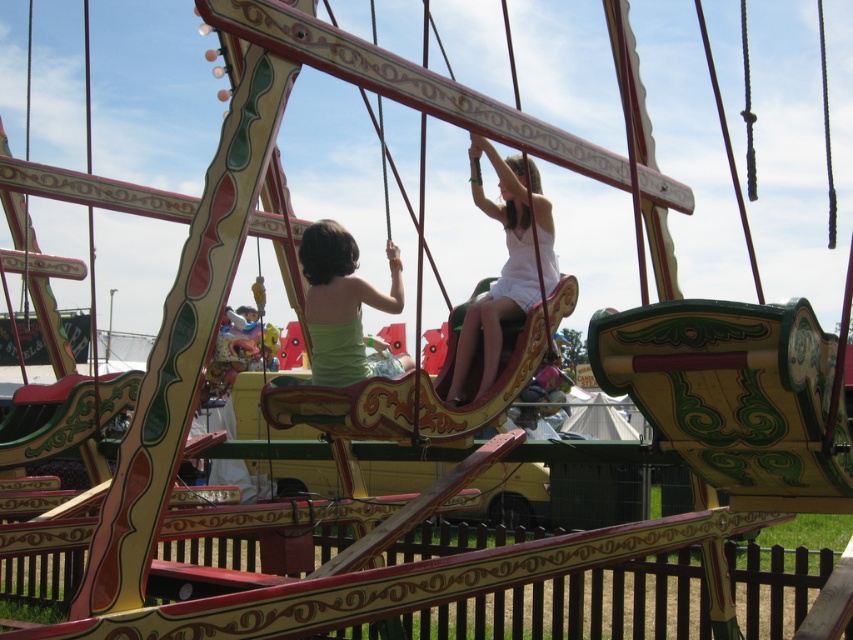
Question: Is white matte dress at upper center above green matte tank top at center?

Choices:
 (A) yes
 (B) no

Answer: (A)

Question: Observing the image, what is the correct spatial positioning of white matte dress at upper center in reference to green matte tank top at center?

Choices:
 (A) left
 (B) right

Answer: (B)

Question: Which point is closer to the camera?

Choices:
 (A) (311, 340)
 (B) (548, 205)

Answer: (B)

Question: Which point is closer to the camera taking this photo?

Choices:
 (A) (463, 378)
 (B) (364, 374)

Answer: (B)

Question: Is the position of white matte dress at upper center more distant than that of green matte tank top at center?

Choices:
 (A) no
 (B) yes

Answer: (B)